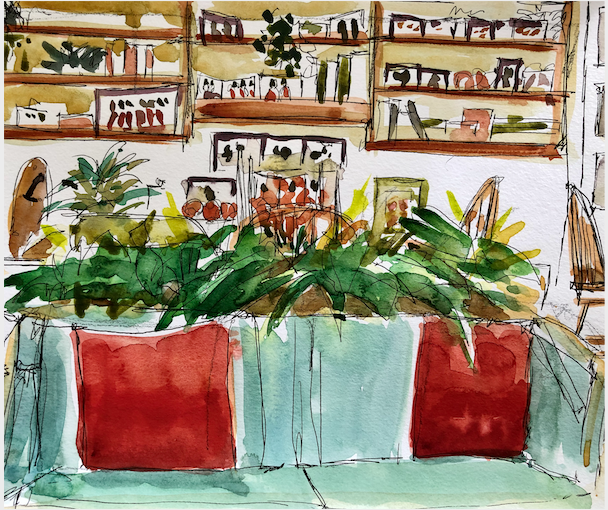
I want to click on 2 pillows, so click(179, 414), click(495, 384).